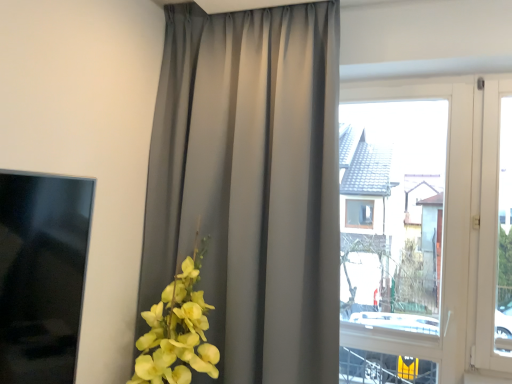
Question: In the image, is satin gray curtain at center positioned in front of or behind transparent glass window at center?

Choices:
 (A) front
 (B) behind

Answer: (A)

Question: Would you say satin gray curtain at center is inside or outside transparent glass window at center?

Choices:
 (A) inside
 (B) outside

Answer: (B)

Question: Is point [314, 236] closer or farther from the camera than point [445, 134]?

Choices:
 (A) farther
 (B) closer

Answer: (B)

Question: Is transparent glass window at center bigger or smaller than satin gray curtain at center?

Choices:
 (A) small
 (B) big

Answer: (A)

Question: Considering the positions of transparent glass window at center and satin gray curtain at center in the image, is transparent glass window at center taller or shorter than satin gray curtain at center?

Choices:
 (A) tall
 (B) short

Answer: (B)

Question: Is point (339, 203) positioned closer to the camera than point (228, 92)?

Choices:
 (A) farther
 (B) closer

Answer: (B)

Question: From a real-world perspective, is transparent glass window at center positioned above or below satin gray curtain at center?

Choices:
 (A) below
 (B) above

Answer: (A)